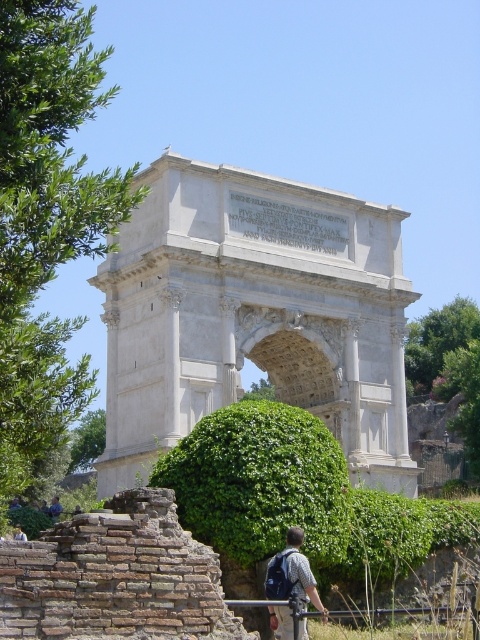
You are a hiker who has just arrived at the classical stone archway. You notice the white stone arch at center and the gray fabric backpack at lower center. Which object is located higher in the scene?

The white stone arch at center is positioned over the gray fabric backpack at lower center, so it is higher in the scene.

You are standing in front of the classical stone archway and see the blue denim jeans at lower center and the light brown leather jacket at lower center. Which item is closer to you?

The blue denim jeans at lower center is closer to you because the light brown leather jacket at lower center is behind it.

You are standing in front of the classical stone archway and want to take a photo. You notice two points marked in the scene. One is at point coordinates point (60,509) and the other is at point (22,536). Which point is closer to your camera lens?

Point (60,509) is further to the camera than point (22,536), so the point closer to the camera lens is point (22,536).